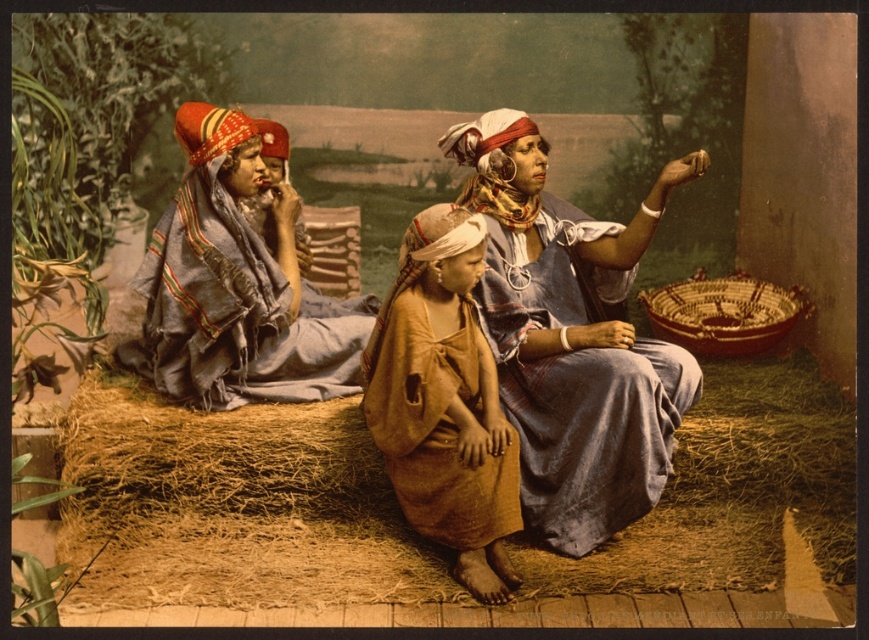
Question: In this image, where is blue woven cloth at left located relative to red woven fabric headscarf at center?

Choices:
 (A) above
 (B) below

Answer: (B)

Question: Does brown straw at lower center appear on the right side of matte blue dress at center?

Choices:
 (A) yes
 (B) no

Answer: (B)

Question: Which object is farther from the camera taking this photo?

Choices:
 (A) brown woven basket at lower right
 (B) brown straw at lower center

Answer: (A)

Question: Does matte blue dress at center appear under blue woven cloth at left?

Choices:
 (A) no
 (B) yes

Answer: (B)

Question: Which point appears closest to the camera in this image?

Choices:
 (A) (436, 260)
 (B) (667, 326)
 (C) (269, 579)
 (D) (445, 145)

Answer: (A)

Question: Which point is farther to the camera?

Choices:
 (A) (509, 205)
 (B) (655, 326)
 (C) (460, 220)
 (D) (224, 385)

Answer: (B)